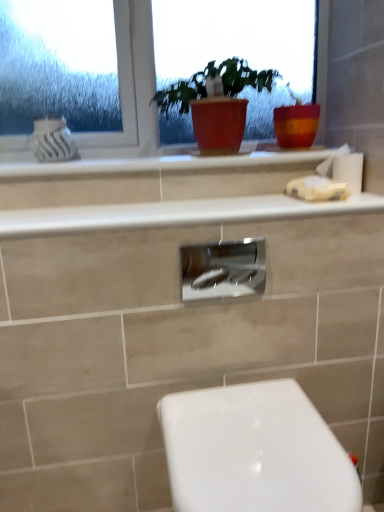
Find the location of a particular element. free point above white glossy counter top at upper center, which ranks as the second counter top in bottom-to-top order (from a real-world perspective) is located at coordinates (159, 153).